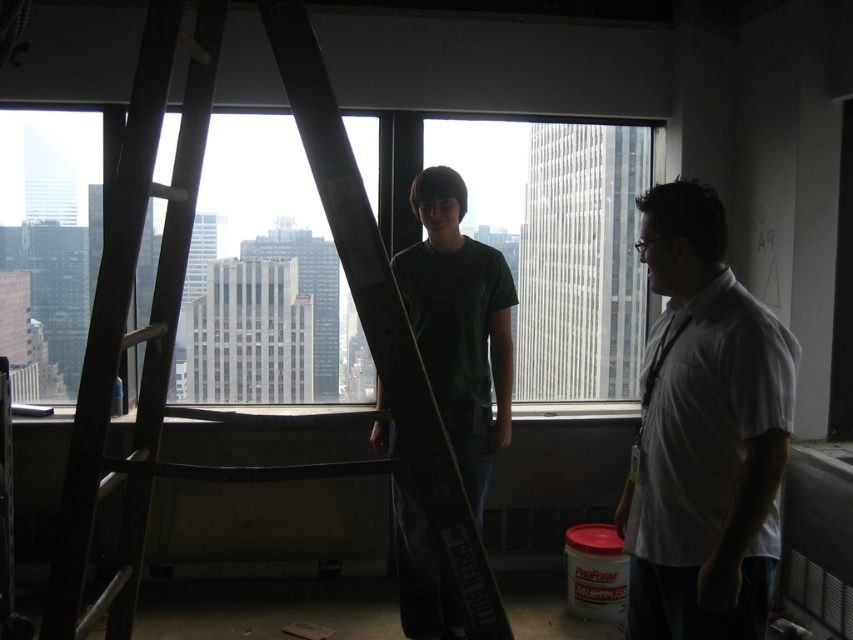
In the scene shown: Who is lower down, white shirt at right or green matte t-shirt at center?

green matte t-shirt at center is below.

Can you confirm if white shirt at right is positioned above green matte t-shirt at center?

Yes.

Which is in front, point (733, 413) or point (444, 209)?

Point (733, 413)

This screenshot has width=853, height=640. What are the coordinates of `white shirt at right` in the screenshot? It's located at (705, 435).

Is wooden ladder at center shorter than white shirt at right?

No.

The image size is (853, 640). Describe the element at coordinates (173, 323) in the screenshot. I see `wooden ladder at center` at that location.

I want to click on wooden ladder at center, so click(173, 323).

Where is `transparent glass window at center`? transparent glass window at center is located at coordinates (540, 259).

What do you see at coordinates (540, 259) in the screenshot? I see `transparent glass window at center` at bounding box center [540, 259].

Find the location of a particular element. transparent glass window at center is located at coordinates (540, 259).